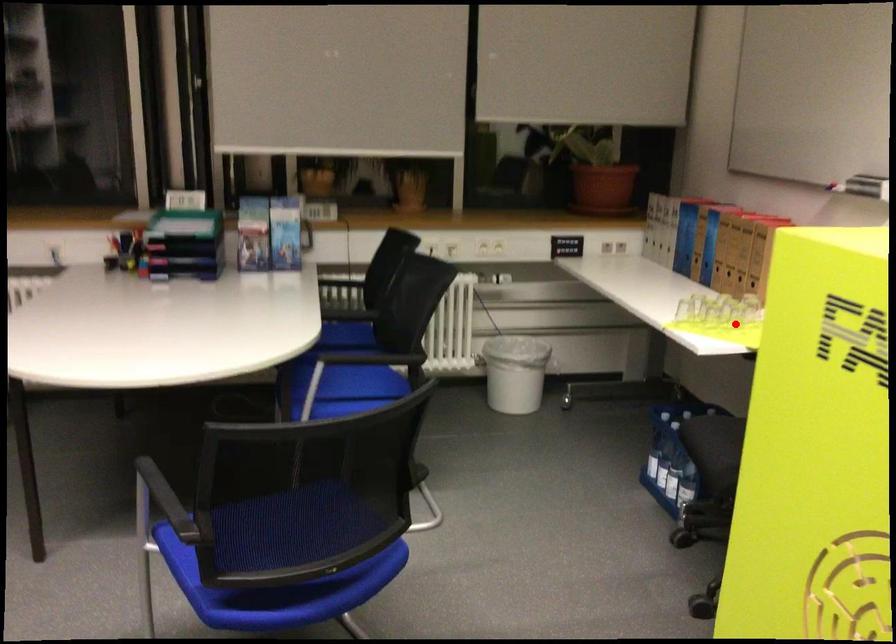
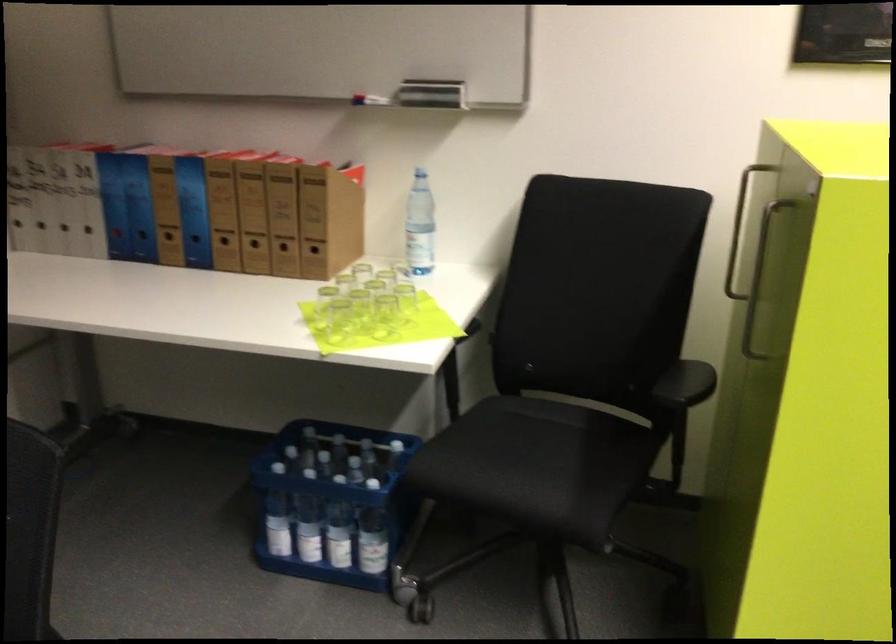
In the second image, find the point that corresponds to the highlighted location in the first image.

(383, 316)